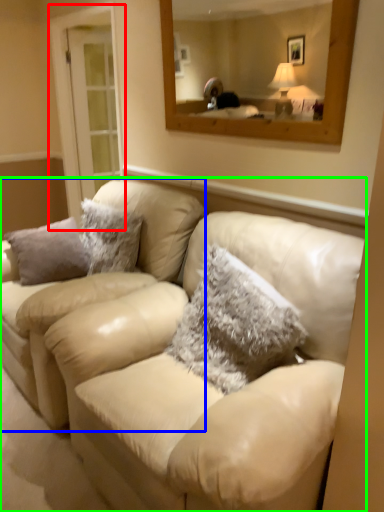
Question: Estimate the real-world distances between objects in this image. Which object is closer to glass door (highlighted by a red box), couch (highlighted by a blue box) or studio couch (highlighted by a green box)?

Choices:
 (A) couch
 (B) studio couch

Answer: (A)